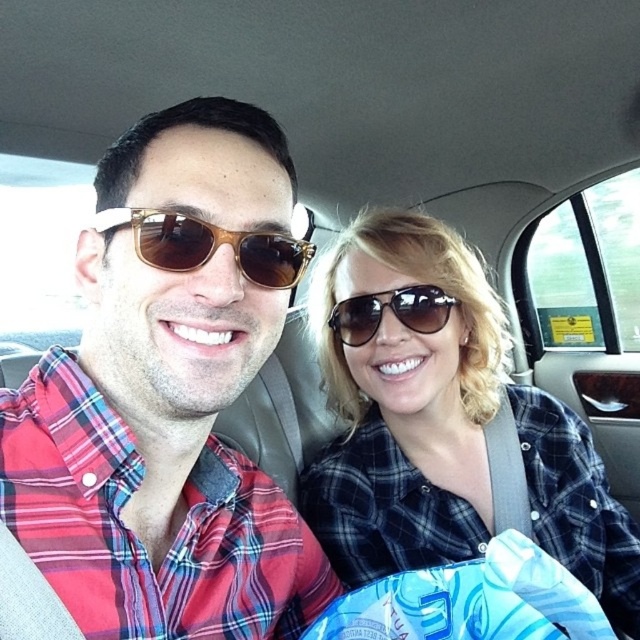
Question: Which of the following is the closest to the observer?

Choices:
 (A) sunglasses at center
 (B) matte black sunglasses at upper center
 (C) brown wood sunglasses at center
 (D) matte plaid shirt at center

Answer: (D)

Question: Considering the real-world distances, which object is closest to the matte plaid shirt at center?

Choices:
 (A) sunglasses at center
 (B) brown wood sunglasses at center
 (C) matte black sunglasses at upper center

Answer: (B)

Question: Based on their relative distances, which object is farther from the sunglasses at center?

Choices:
 (A) matte plaid shirt at center
 (B) matte black sunglasses at upper center
 (C) brown wood sunglasses at center

Answer: (A)

Question: Considering the relative positions of brown wood sunglasses at center and sunglasses at center in the image provided, where is brown wood sunglasses at center located with respect to sunglasses at center?

Choices:
 (A) below
 (B) above

Answer: (B)

Question: Can you confirm if matte plaid shirt at center is positioned below brown wood sunglasses at center?

Choices:
 (A) yes
 (B) no

Answer: (A)

Question: Where is brown wood sunglasses at center located in relation to sunglasses at center in the image?

Choices:
 (A) above
 (B) below

Answer: (A)